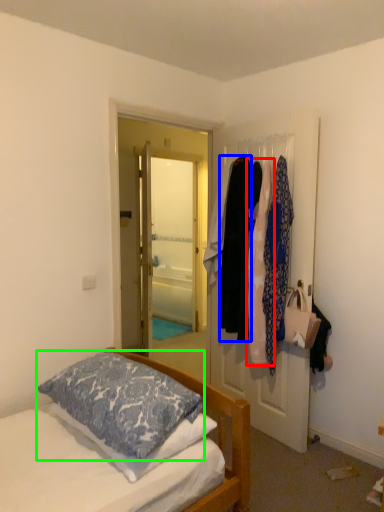
Question: Which is nearer to the clothing (highlighted by a red box)? clothing (highlighted by a blue box) or pillow (highlighted by a green box).

Choices:
 (A) clothing
 (B) pillow

Answer: (A)